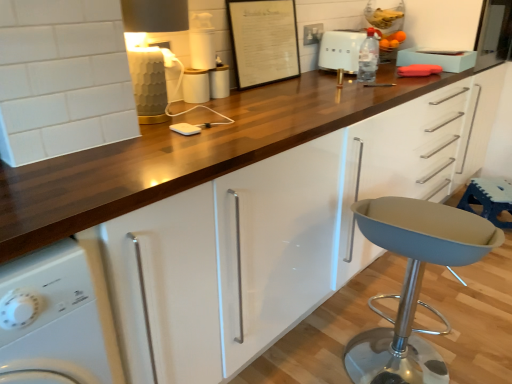
Where is `blue fabric bar stool at lower right`? blue fabric bar stool at lower right is located at coordinates (489, 199).

The image size is (512, 384). I want to click on matte gray stool at lower right, so click(x=413, y=283).

The image size is (512, 384). Find the location of `white matte charger at center, positioned as the fourth appliance in top-to-bottom order`. white matte charger at center, positioned as the fourth appliance in top-to-bottom order is located at coordinates (185, 129).

This screenshot has height=384, width=512. What do you see at coordinates (185, 129) in the screenshot?
I see `white matte charger at center, the 1th appliance positioned from the bottom` at bounding box center [185, 129].

Locate an element on the screen. white plastic container at upper center, which appears as the fourth appliance when ordered from the bottom is located at coordinates (202, 42).

Considering the sizes of objects white plastic toaster at upper center and white matte charger at center, positioned as the fourth appliance in top-to-bottom order, in the image provided, who is taller, white plastic toaster at upper center or white matte charger at center, positioned as the fourth appliance in top-to-bottom order,?

white plastic toaster at upper center is taller.

Could you tell me if white plastic toaster at upper center is turned towards white matte charger at center, the 1th appliance positioned from the bottom?

No, white plastic toaster at upper center does not turn towards white matte charger at center, the 1th appliance positioned from the bottom.

From the picture: In terms of width, does white plastic toaster at upper center look wider or thinner when compared to white matte charger at center, positioned as the fourth appliance in top-to-bottom order?

In the image, white plastic toaster at upper center appears to be wider than white matte charger at center, positioned as the fourth appliance in top-to-bottom order.

Considering the relative sizes of white plastic container at upper center, which appears as the fourth appliance when ordered from the bottom, and white plastic toaster at upper center in the image provided, is white plastic container at upper center, which appears as the fourth appliance when ordered from the bottom, bigger than white plastic toaster at upper center?

Actually, white plastic container at upper center, which appears as the fourth appliance when ordered from the bottom, might be smaller than white plastic toaster at upper center.

Which is behind, point (198, 61) or point (332, 57)?

The point (332, 57) is more distant.

From a real-world perspective, who is located lower, white plastic container at upper center, which appears as the fourth appliance when ordered from the bottom, or white plastic toaster at upper center?

white plastic toaster at upper center.

Is white plastic container at upper center, which appears as the fourth appliance when ordered from the bottom, positioned far away from white plastic toaster at upper center?

Actually, white plastic container at upper center, which appears as the fourth appliance when ordered from the bottom, and white plastic toaster at upper center are a little close together.

From the image's perspective, which object appears higher, white paper at upper center or white plastic container at upper center, the 1th appliance in the top-to-bottom sequence?

white paper at upper center appears higher in the image.

Does white paper at upper center appear on the left side of white plastic container at upper center, which appears as the fourth appliance when ordered from the bottom?

In fact, white paper at upper center is to the right of white plastic container at upper center, which appears as the fourth appliance when ordered from the bottom.

Is point (290, 65) less distant than point (193, 61)?

No, it is not.

Considering the positions of objects white paper at upper center and white plastic container at upper center, the 1th appliance in the top-to-bottom sequence, in the image provided, who is in front, white paper at upper center or white plastic container at upper center, the 1th appliance in the top-to-bottom sequence,?

white plastic container at upper center, the 1th appliance in the top-to-bottom sequence.

Would you say white paper at upper center contains white plastic electric outlet at upper center?

Definitely not — white plastic electric outlet at upper center is not inside white paper at upper center.

Which of these two, white paper at upper center or white plastic electric outlet at upper center, stands taller?

With more height is white paper at upper center.

Is white paper at upper center not near white plastic electric outlet at upper center?

white paper at upper center is actually quite close to white plastic electric outlet at upper center.

Which of these two, white paper at upper center or white plastic electric outlet at upper center, is bigger?

white paper at upper center is bigger.

Can you confirm if transparent plastic bottle at upper center is bigger than white matte charger at center, the 1th appliance positioned from the bottom?

Correct, transparent plastic bottle at upper center is larger in size than white matte charger at center, the 1th appliance positioned from the bottom.

From a real-world perspective, is transparent plastic bottle at upper center above or below white matte charger at center, the 1th appliance positioned from the bottom?

transparent plastic bottle at upper center is above white matte charger at center, the 1th appliance positioned from the bottom.

How many degrees apart are the facing directions of transparent plastic bottle at upper center and white matte charger at center, positioned as the fourth appliance in top-to-bottom order?

87.1 degrees separate the facing orientations of transparent plastic bottle at upper center and white matte charger at center, positioned as the fourth appliance in top-to-bottom order.

Is transparent plastic bottle at upper center oriented away from white matte charger at center, the 1th appliance positioned from the bottom?

That's not correct — transparent plastic bottle at upper center is not looking away from white matte charger at center, the 1th appliance positioned from the bottom.

Which is less distant, (188, 99) or (372, 60)?

Point (188, 99) is closer to the camera than point (372, 60).

From a real-world perspective, between white glossy cup at center, which is the 2th appliance in bottom-to-top order, and transparent plastic bottle at upper center, who is vertically lower?

white glossy cup at center, which is the 2th appliance in bottom-to-top order, from a real-world perspective.

Is white glossy cup at center, which is the 2th appliance in bottom-to-top order, looking in the opposite direction of transparent plastic bottle at upper center?

That's not correct — white glossy cup at center, which is the 2th appliance in bottom-to-top order, is not looking away from transparent plastic bottle at upper center.

Looking at their sizes, would you say white glossy cup at center, which is the 2th appliance in bottom-to-top order, is wider or thinner than transparent plastic bottle at upper center?

Considering their sizes, white glossy cup at center, which is the 2th appliance in bottom-to-top order, looks broader than transparent plastic bottle at upper center.

Which object is wider, white plastic container at upper center, which appears as the fourth appliance when ordered from the bottom, or white matte charger at center, the 1th appliance positioned from the bottom?

Wider between the two is white matte charger at center, the 1th appliance positioned from the bottom.

Are white plastic container at upper center, which appears as the fourth appliance when ordered from the bottom, and white matte charger at center, positioned as the fourth appliance in top-to-bottom order, far apart?

That's not correct — white plastic container at upper center, which appears as the fourth appliance when ordered from the bottom, is a little close to white matte charger at center, positioned as the fourth appliance in top-to-bottom order.

How many degrees apart are the facing directions of white plastic container at upper center, the 1th appliance in the top-to-bottom sequence, and white matte charger at center, positioned as the fourth appliance in top-to-bottom order?

The facing directions of white plastic container at upper center, the 1th appliance in the top-to-bottom sequence, and white matte charger at center, positioned as the fourth appliance in top-to-bottom order, are 0.634 degrees apart.

Image resolution: width=512 pixels, height=384 pixels. What are the coordinates of `the 1st appliance counting from the left side of the white plastic container at upper center, which appears as the fourth appliance when ordered from the bottom` in the screenshot? It's located at (185, 129).

From a real-world perspective, which appliance is the 3rd one underneath the white plastic toaster at upper center? Please provide its 2D coordinates.

[(185, 129)]

From the image's perspective, count 1st appliances downward from the white plastic toaster at upper center and point to it. Please provide its 2D coordinates.

[(202, 42)]

From the picture: Looking at the image, which one is located further to white plastic toaster at upper center, white matte charger at center, the 1th appliance positioned from the bottom, or white plastic electric outlet at upper center?

Among the two, white matte charger at center, the 1th appliance positioned from the bottom, is located further to white plastic toaster at upper center.

When comparing their distances from white plastic container at upper center, the 1th appliance in the top-to-bottom sequence, does white plastic electric outlet at upper center or blue fabric bar stool at lower right seem further?

blue fabric bar stool at lower right is further to white plastic container at upper center, the 1th appliance in the top-to-bottom sequence.

In the scene shown: Looking at the image, which one is located closer to metallic silver canister at center, acting as the second appliance starting from the top, matte gray stool at lower right or white plastic container at upper center, the 1th appliance in the top-to-bottom sequence?

white plastic container at upper center, the 1th appliance in the top-to-bottom sequence, lies closer to metallic silver canister at center, acting as the second appliance starting from the top, than the other object.

Looking at the image, which one is located closer to white glossy washing machine at lower left, matte gray stool at lower right or white paper at upper center?

matte gray stool at lower right is closer to white glossy washing machine at lower left.

Based on their spatial positions, is white matte charger at center, the 1th appliance positioned from the bottom, or white glossy cup at center, which is the 2th appliance in bottom-to-top order, closer to white glossy washing machine at lower left?

white matte charger at center, the 1th appliance positioned from the bottom, is closer to white glossy washing machine at lower left.

Based on the photo, when comparing their distances from white glossy cup at center, the 3th appliance when ordered from top to bottom, does transparent plastic bottle at upper center or white plastic electric outlet at upper center seem further?

Based on the image, white plastic electric outlet at upper center appears to be further to white glossy cup at center, the 3th appliance when ordered from top to bottom.

When comparing their distances from white plastic toaster at upper center, does metallic silver canister at center, which is the 3th appliance from bottom to top, or white plastic container at upper center, the 1th appliance in the top-to-bottom sequence, seem closer?

metallic silver canister at center, which is the 3th appliance from bottom to top.

Which object lies further to the anchor point white matte charger at center, the 1th appliance positioned from the bottom, matte gray stool at lower right or white glossy washing machine at lower left?

Among the two, matte gray stool at lower right is located further to white matte charger at center, the 1th appliance positioned from the bottom.

Locate an element on the screen. The height and width of the screenshot is (384, 512). stool between white plastic container at upper center, the 1th appliance in the top-to-bottom sequence, and blue fabric bar stool at lower right, in the horizontal direction is located at coordinates (413, 283).

Where is `toaster between white paper at upper center and white plastic electric outlet at upper center in the front-back direction`? The height and width of the screenshot is (384, 512). toaster between white paper at upper center and white plastic electric outlet at upper center in the front-back direction is located at coordinates (341, 50).

Locate an element on the screen. This screenshot has height=384, width=512. bulletin board between white matte charger at center, positioned as the fourth appliance in top-to-bottom order, and white plastic electric outlet at upper center from front to back is located at coordinates (263, 41).

Find the location of `bulletin board that lies between white plastic electric outlet at upper center and matte gray stool at lower right from top to bottom`. bulletin board that lies between white plastic electric outlet at upper center and matte gray stool at lower right from top to bottom is located at coordinates (263, 41).